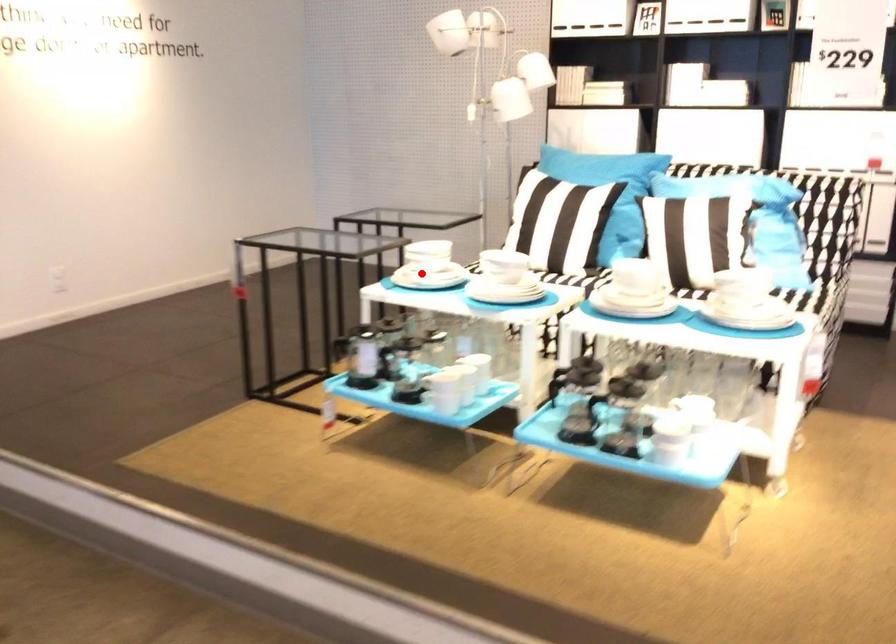
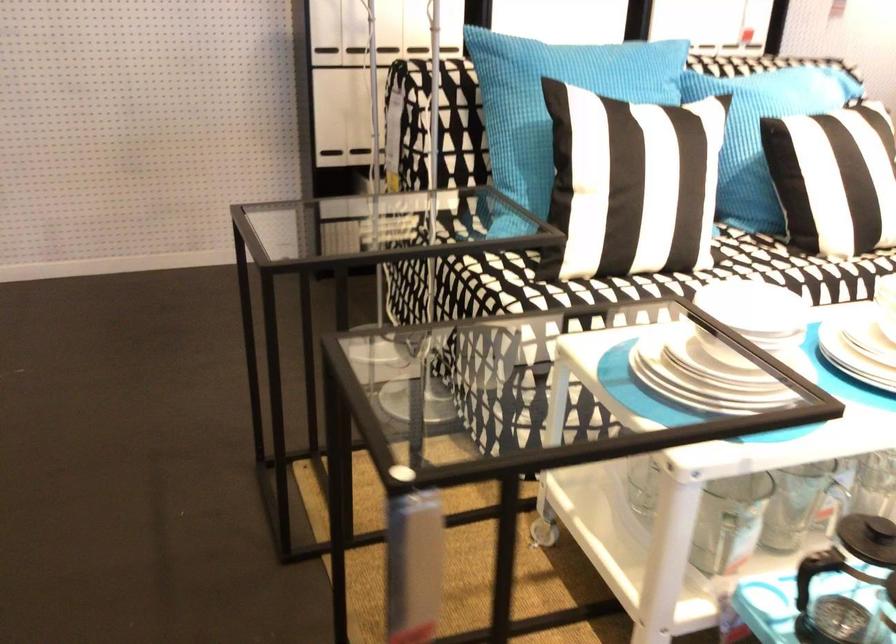
Question: I am providing you with two images of the same scene from different viewpoints. Image1 has a red point marked. In image2, the corresponding 3D location appears at what relative position? Reply with the corresponding letter.

Choices:
 (A) Closer
 (B) Farther

Answer: (A)